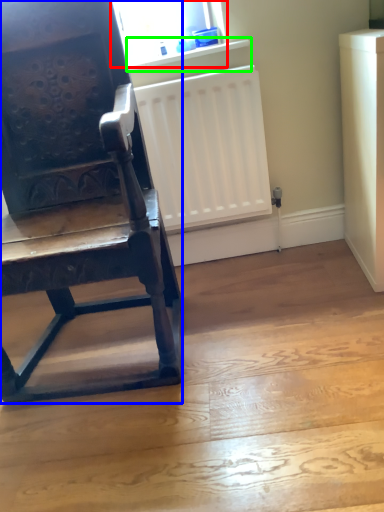
Question: Based on their relative distances, which object is nearer to window screen (highlighted by a red box)? Choose from chair (highlighted by a blue box) and window sill (highlighted by a green box).

Choices:
 (A) chair
 (B) window sill

Answer: (B)